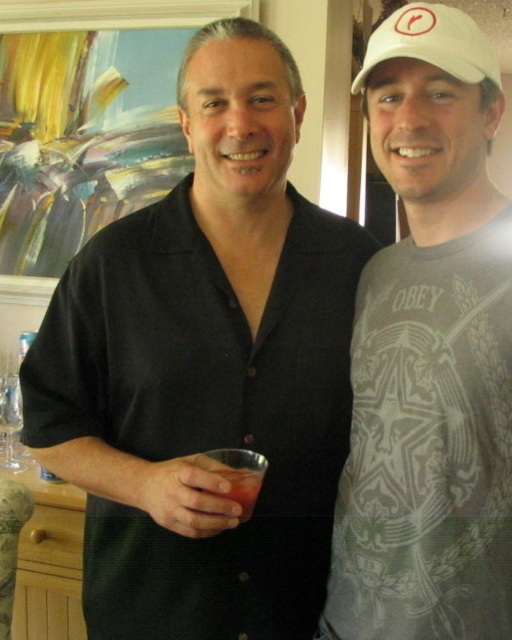
Is point (406, 22) positioned in front of point (474, 45)?

Yes, it is.

Does gray matte t-shirt at center have a lesser height compared to white fabric cap at upper right?

No.

Who is more distant from viewer, (x=438, y=90) or (x=454, y=58)?

Positioned behind is point (x=438, y=90).

Locate an element on the screen. The width and height of the screenshot is (512, 640). gray matte t-shirt at center is located at coordinates (430, 353).

Who is shorter, gray matte t-shirt at center or clear glass wine glass at lower left?

clear glass wine glass at lower left

Locate an element on the screen. This screenshot has height=640, width=512. gray matte t-shirt at center is located at coordinates (430, 353).

You are a GUI agent. You are given a task and a screenshot of the screen. Output one action in this format:
    pyautogui.click(x=<x>, y=<y>)
    Task: Click on the gray matte t-shirt at center
    This screenshot has width=512, height=640.
    Given the screenshot: What is the action you would take?
    pyautogui.click(x=430, y=353)

Is point (74, 257) more distant than point (453, 65)?

Yes, point (74, 257) is behind point (453, 65).

Can you confirm if black cotton shirt at center is wider than white fabric cap at upper right?

Indeed, black cotton shirt at center has a greater width compared to white fabric cap at upper right.

Describe the element at coordinates (205, 369) in the screenshot. I see `black cotton shirt at center` at that location.

Image resolution: width=512 pixels, height=640 pixels. I want to click on black cotton shirt at center, so click(205, 369).